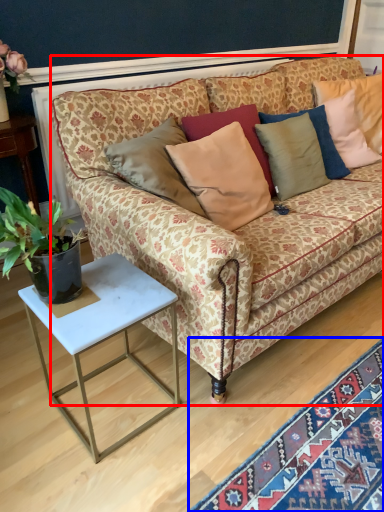
Question: Among these objects, which one is nearest to the camera, studio couch (highlighted by a red box) or mat (highlighted by a blue box)?

Choices:
 (A) studio couch
 (B) mat

Answer: (B)